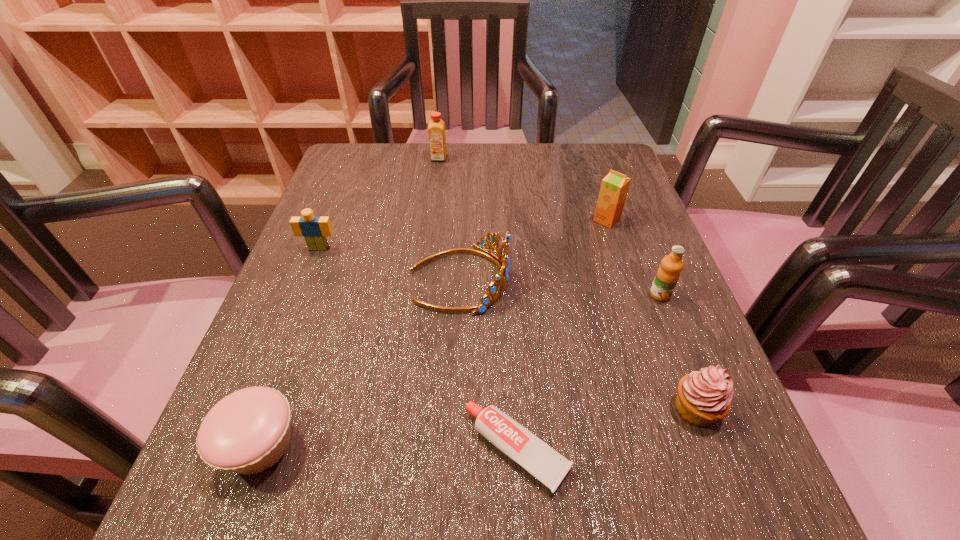
The height and width of the screenshot is (540, 960). Identify the location of the farthest object. (436, 129).

Find the location of a particular element. Image resolution: width=960 pixels, height=540 pixels. the leftmost orange juice is located at coordinates 436,129.

This screenshot has width=960, height=540. Identify the location of the second nearest orange juice. (614, 187).

The image size is (960, 540). I want to click on the second farthest object, so click(614, 187).

Locate an element on the screen. tiara is located at coordinates (501, 279).

Find the location of `the rightmost orange juice`. the rightmost orange juice is located at coordinates (667, 276).

This screenshot has width=960, height=540. Identify the location of Lego. (314, 229).

The image size is (960, 540). In order to click on the right cupcake in this screenshot , I will do `click(704, 397)`.

I want to click on the shorter cupcake, so click(248, 431).

Image resolution: width=960 pixels, height=540 pixels. What are the coordinates of `the left cupcake` in the screenshot? It's located at tap(248, 431).